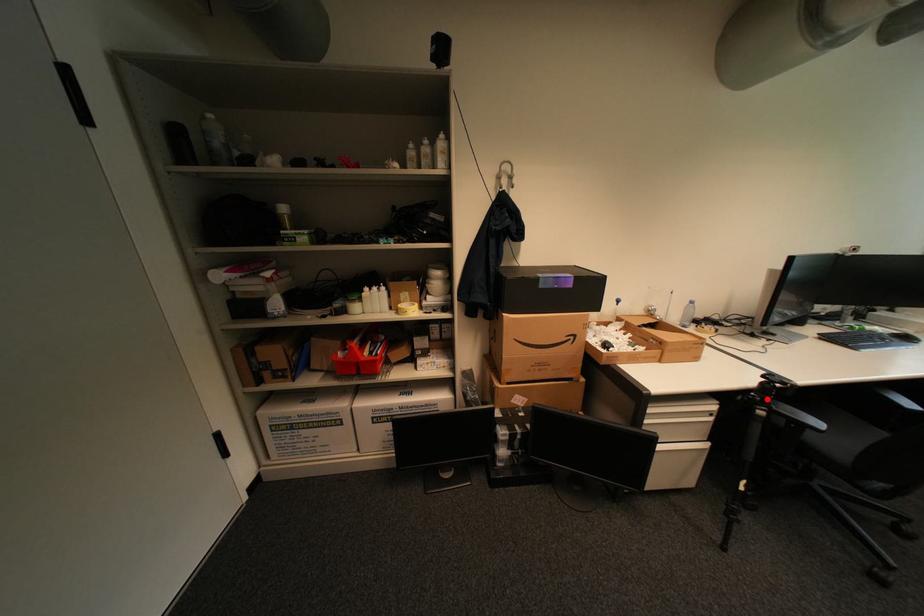
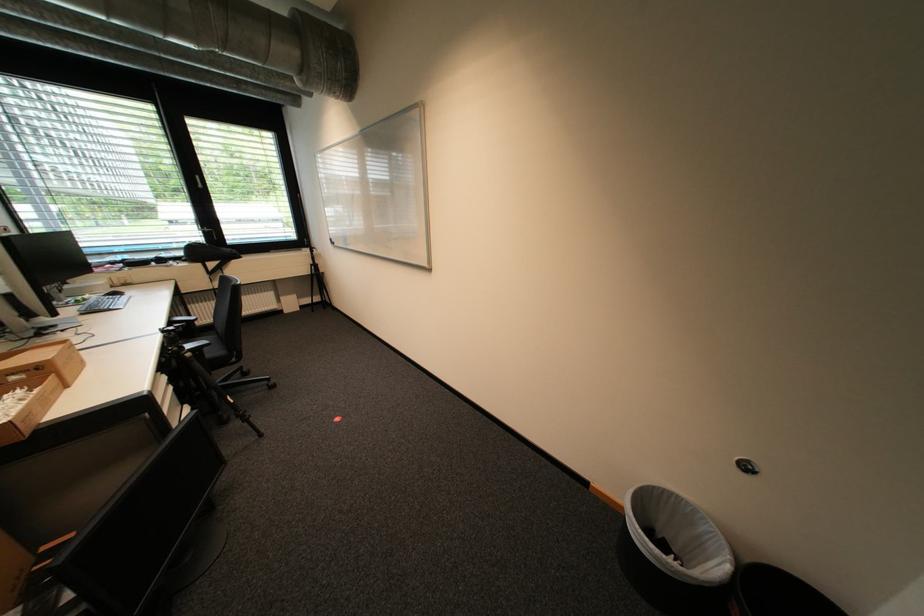
Question: A red point is marked in image1. In image2, is the corresponding 3D point closer to the camera or farther? Reply with the corresponding letter.

Choices:
 (A) The corresponding 3D point is closer.
 (B) The corresponding 3D point is farther.

Answer: (A)